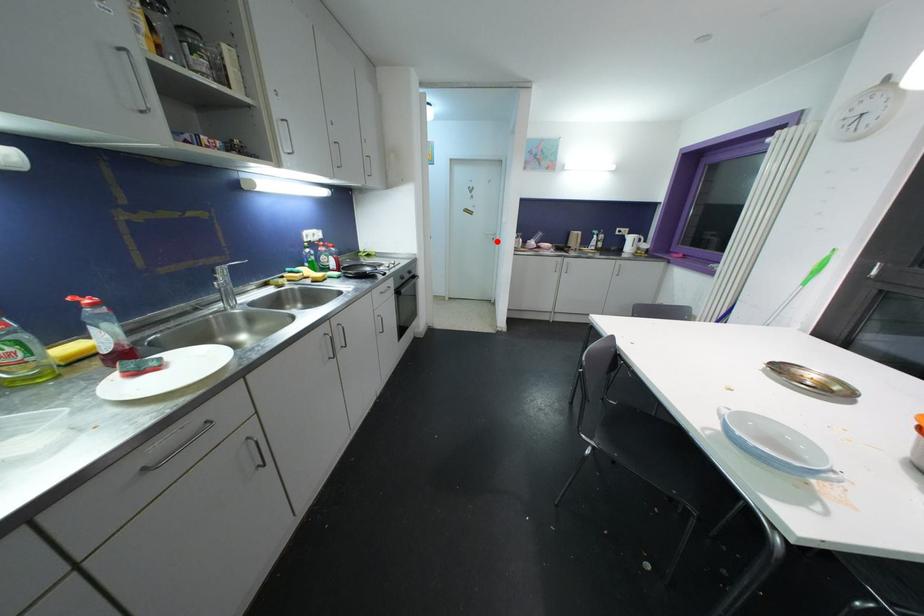
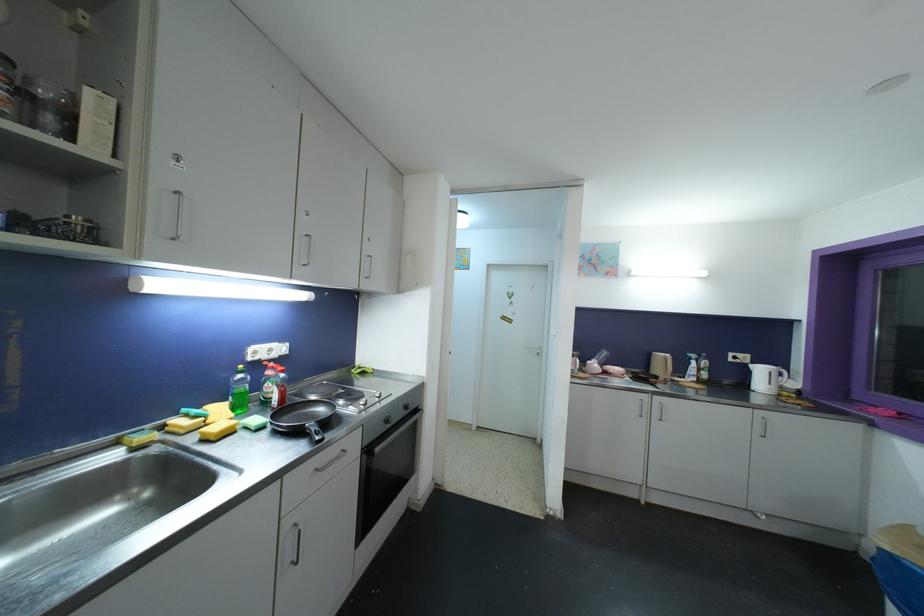
Locate, in the second image, the point that corresponds to the highlighted location in the first image.

(542, 357)